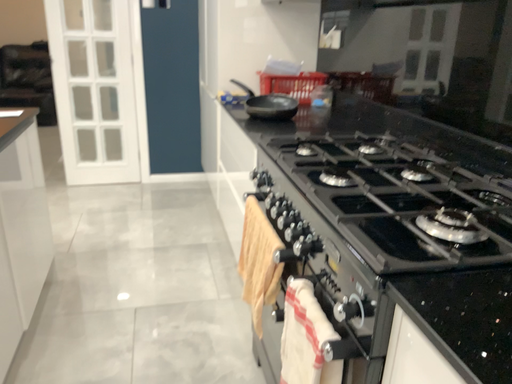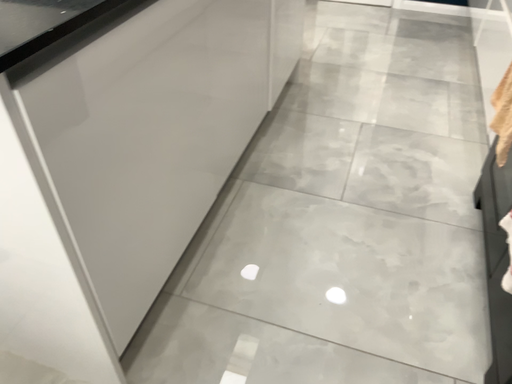
Question: Which way did the camera rotate in the video?

Choices:
 (A) rotated downward
 (B) rotated upward

Answer: (A)